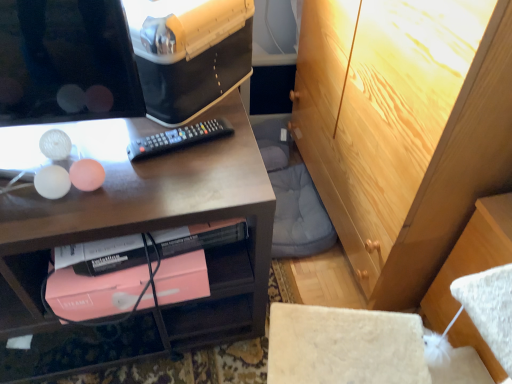
Question: From their relative heights in the image, would you say black plastic remote at center is taller or shorter than light brown wood cabinet at upper right?

Choices:
 (A) short
 (B) tall

Answer: (A)

Question: Considering the positions of black plastic remote at center and light brown wood cabinet at upper right in the image, is black plastic remote at center wider or thinner than light brown wood cabinet at upper right?

Choices:
 (A) thin
 (B) wide

Answer: (A)

Question: Based on their relative distances, which object is nearer to the pink matte book at lower center?

Choices:
 (A) light brown wood cabinet at upper right
 (B) black plastic remote at center
 (C) matte wood desk at upper left

Answer: (C)

Question: Which object is positioned closest to the black plastic remote at center?

Choices:
 (A) pink matte book at lower center
 (B) light brown wood cabinet at upper right
 (C) matte wood desk at upper left

Answer: (A)